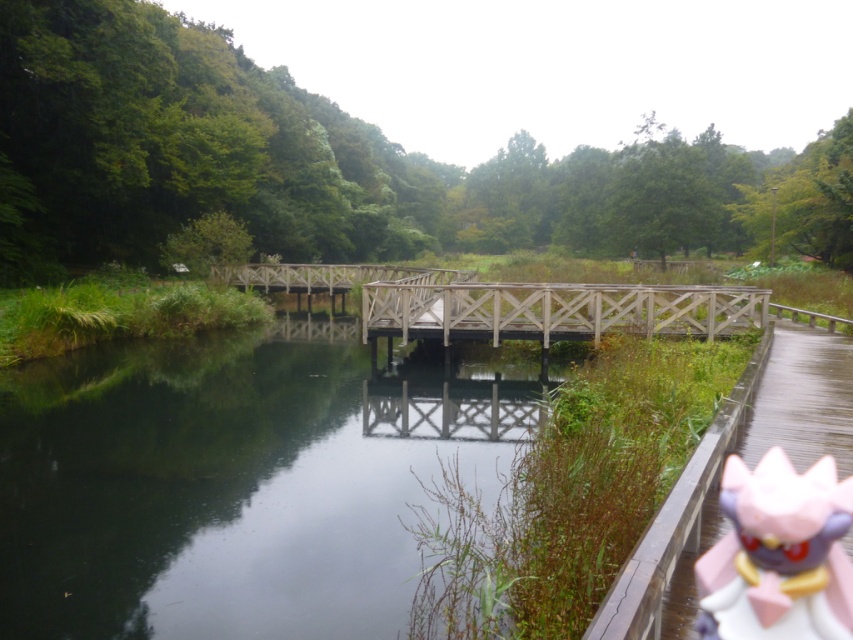
Question: Which of the following is the closest to the observer?

Choices:
 (A) (82, 488)
 (B) (837, 624)

Answer: (B)

Question: Can you confirm if pink plastic doll at lower right is positioned above wooden bridge at center?

Choices:
 (A) no
 (B) yes

Answer: (A)

Question: From the image, what is the correct spatial relationship of dark reflective water at center in relation to pink plastic doll at lower right?

Choices:
 (A) above
 (B) below

Answer: (B)

Question: Which point is closer to the camera?

Choices:
 (A) (312, 452)
 (B) (506, 316)

Answer: (A)

Question: Which object is closer to the camera taking this photo?

Choices:
 (A) dark reflective water at center
 (B) wooden bridge at center
 (C) pink plastic doll at lower right

Answer: (C)

Question: Does pink plastic doll at lower right lie behind wooden bridge at center?

Choices:
 (A) yes
 (B) no

Answer: (B)